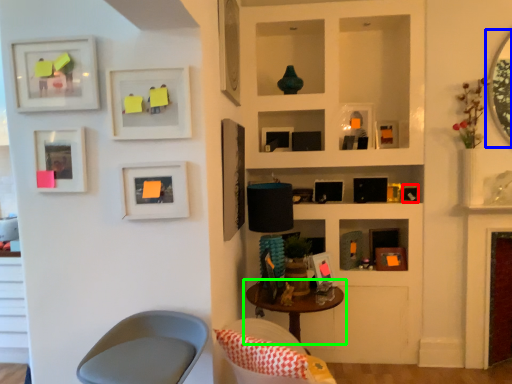
Question: Which object is positioned closest to picture frame (highlighted by a red box)? Select from mirror (highlighted by a blue box) and table (highlighted by a green box).

Choices:
 (A) mirror
 (B) table

Answer: (A)